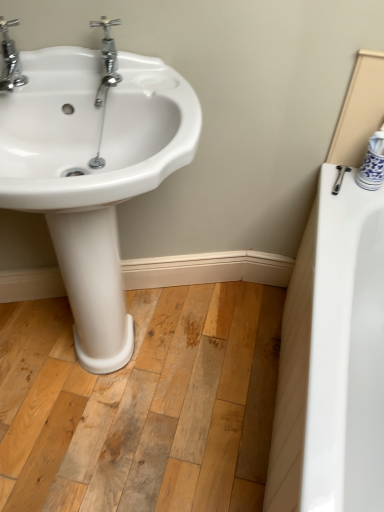
Identify the location of free area in between chrome metallic faucet at upper left, the second tap when ordered from right to left, and chrome/metallic faucet at upper left, the 2th tap in the left-to-right sequence. (62, 79).